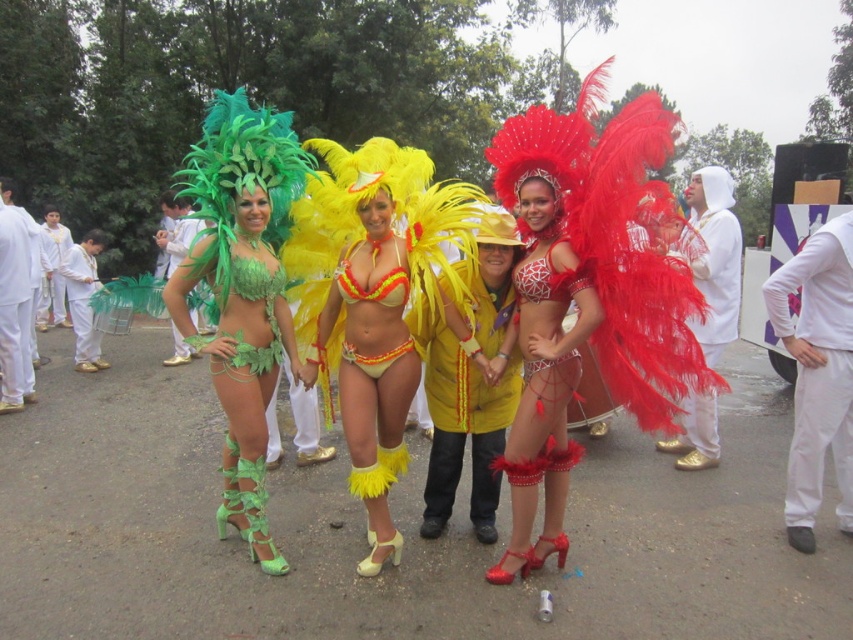
Please look at the image and locate the green matte bikini at left. What are its coordinates in the image?

The green matte bikini at left is located at coordinates point (241, 291).

Looking at this image, you are standing in the middle of the parade and see two points in the image. The first point is at coordinate point (219, 387) and the second point is at coordinate point (343, 305). Which point is closer to you?

Point (219, 387) is closer to the viewer than point (343, 305).

You are a photographer at the event and want to focus on both the point at point (x=393, y=260) and the point at point (x=595, y=301). Which point is closer to your camera lens?

Point (x=393, y=260) is further to the camera than point (x=595, y=301), so the point at point (x=595, y=301) is closer to the camera lens.